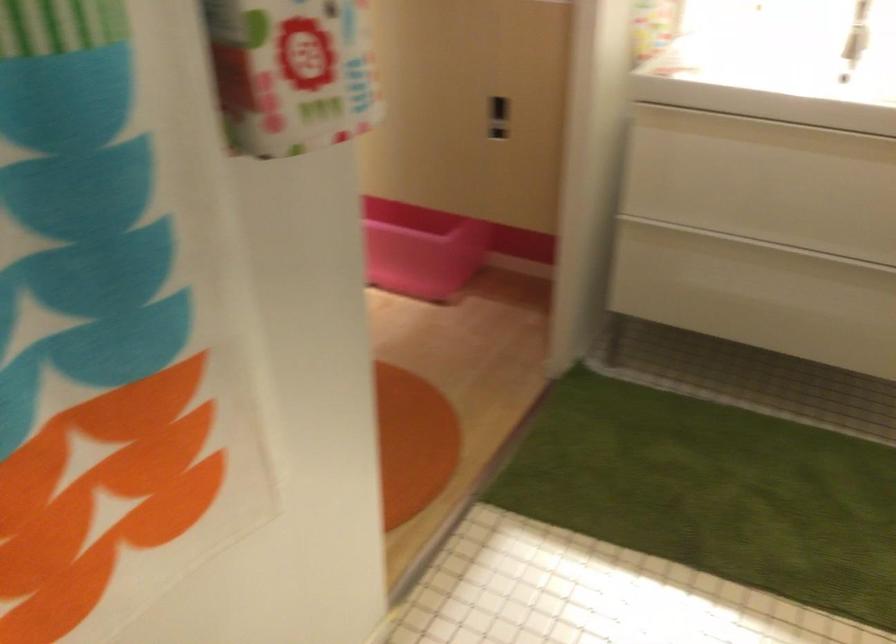
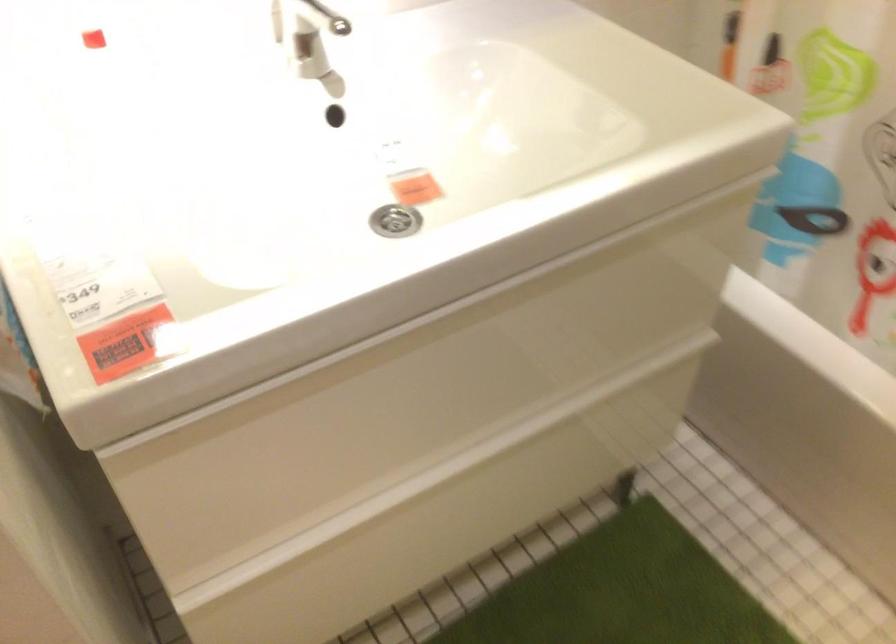
The point at (774, 169) is marked in the first image. Where is the corresponding point in the second image?

(423, 392)